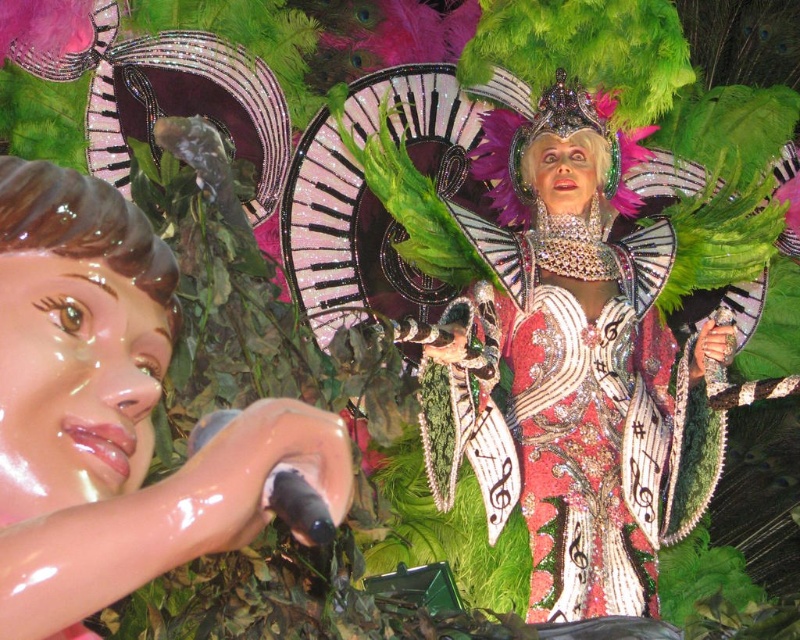
You are a photographer trying to capture the perfect shot of the costume. You notice two points marked in the image. The first point is at coordinates point (90,538) and the second is at point (552,467). Which point should you focus on to ensure the foreground of your photo is sharp?

Point (90,538) is in front of point (552,467), so focusing on point (90,538) will ensure the foreground is sharp.

You are a costume designer who needs to place a matte plastic doll at left and a shiny sequined dress at center in a display case. The display case is 150 feet long. Can both items fit side by side without overlapping?

The matte plastic doll at left is 140.12 feet from the shiny sequined dress at center. Since the display case is 150 feet long, there is enough space between them to fit both items side by side without overlapping.

You are a costume designer preparing for a performance. You have a matte plastic doll at left and a shiny sequined dress at center. Which object is placed higher in the image?

The matte plastic doll at left is positioned over the shiny sequined dress at center, so it is placed higher in the image.